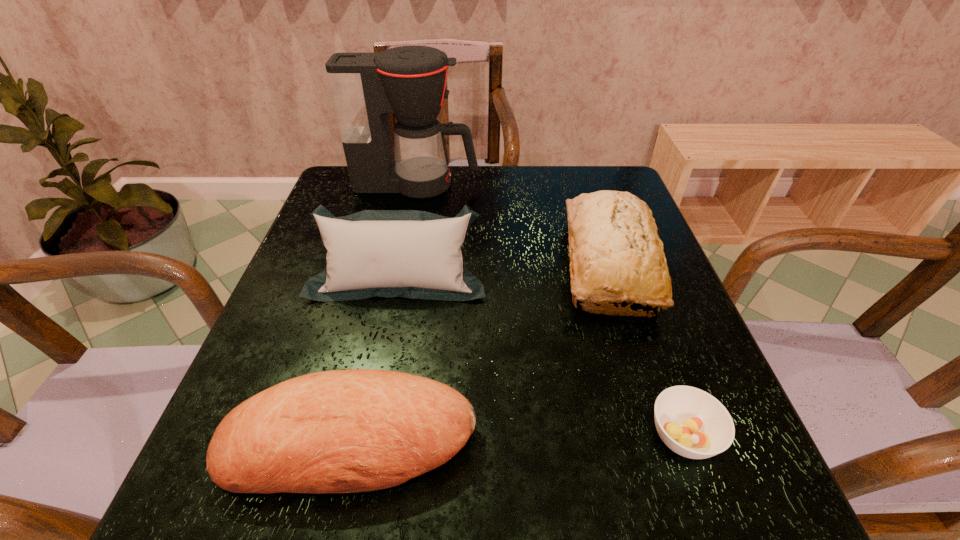
Locate an element on the screen. The height and width of the screenshot is (540, 960). soup bowl positioned at the right edge is located at coordinates (691, 422).

Where is `object located at the far left corner`? The width and height of the screenshot is (960, 540). object located at the far left corner is located at coordinates (409, 82).

Image resolution: width=960 pixels, height=540 pixels. In order to click on object that is at the near left corner in this screenshot , I will do `click(343, 431)`.

Locate an element on the screen. This screenshot has height=540, width=960. object located at the near right corner is located at coordinates (691, 422).

Find the location of a particular element. Image resolution: width=960 pixels, height=540 pixels. vacant space at the far edge of the desktop is located at coordinates (514, 181).

Find the location of `free space at the near edge`. free space at the near edge is located at coordinates (492, 504).

Locate an element on the screen. The width and height of the screenshot is (960, 540). free space at the left edge of the desktop is located at coordinates (318, 319).

Locate an element on the screen. The image size is (960, 540). vacant area at the right edge of the desktop is located at coordinates (644, 338).

Identify the location of free space at the far left corner of the desktop. Image resolution: width=960 pixels, height=540 pixels. (352, 203).

Image resolution: width=960 pixels, height=540 pixels. I want to click on vacant space at the near left corner of the desktop, so click(x=247, y=507).